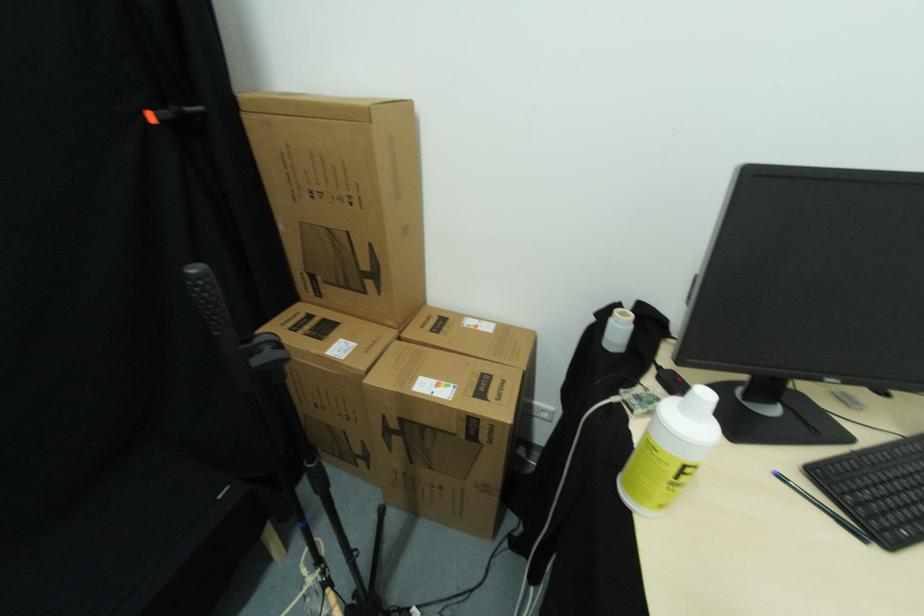
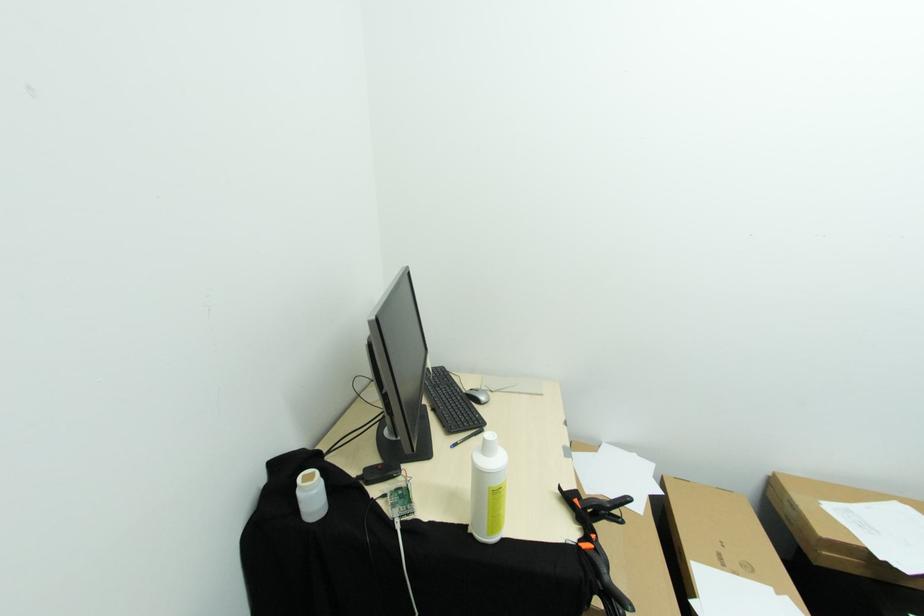
In the second image, find the point that corresponds to point (881, 548) in the first image.

(487, 431)